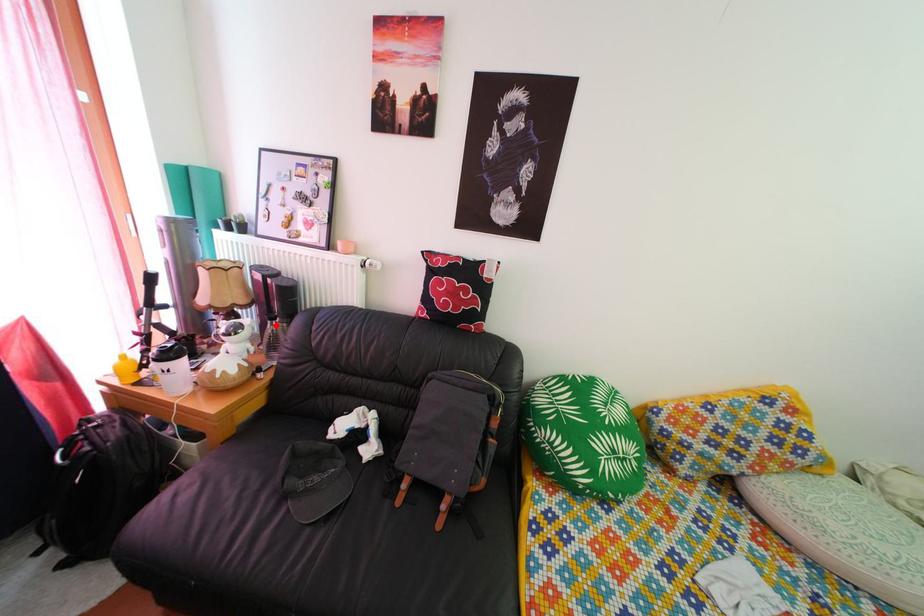
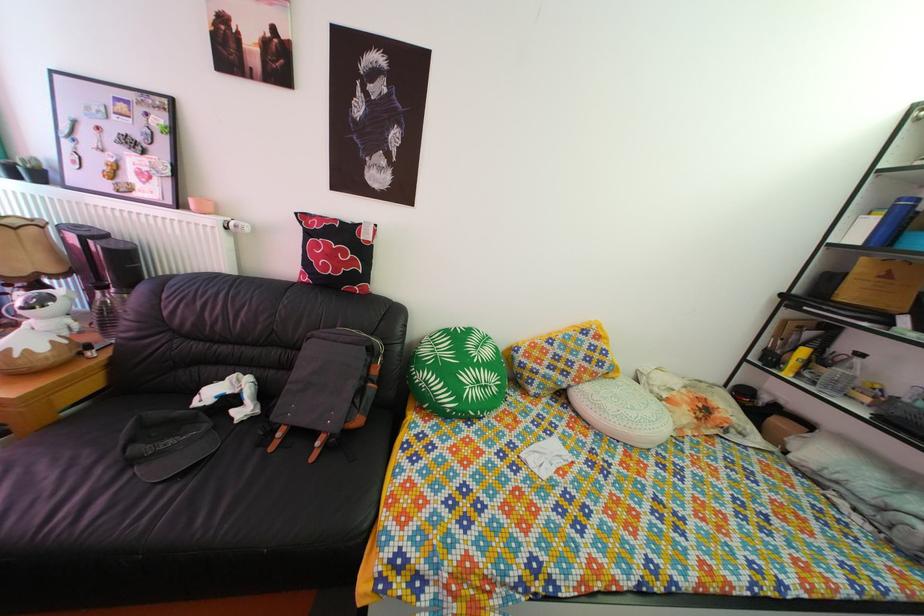
Question: I am providing you with two images of the same scene from different viewpoints. A red point is marked on the first image. Is the red point's position out of view in image 2?

Choices:
 (A) Yes
 (B) No

Answer: (B)